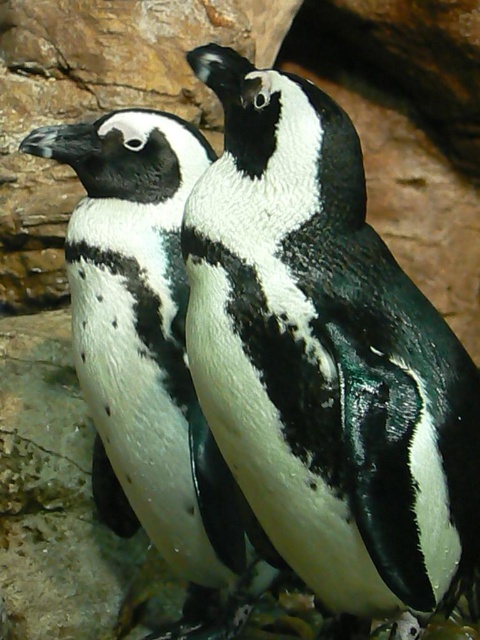
You are a zookeeper observing two penguins in their enclosure. You notice two specific points marked in the image. The first point is at coordinates point (292, 300), and the second is at point (167, 152). From your vantage point, which of these two points is closer to you?

Point (292, 300) is in front of point (167, 152), so the first point is closer to you.

You are a zookeeper observing two African penguins in their enclosure. You notice the black matte penguin at center and the black and white feathers at center. Which of these is located to the left?

The black and white feathers at center are located to the left of the black matte penguin at center.